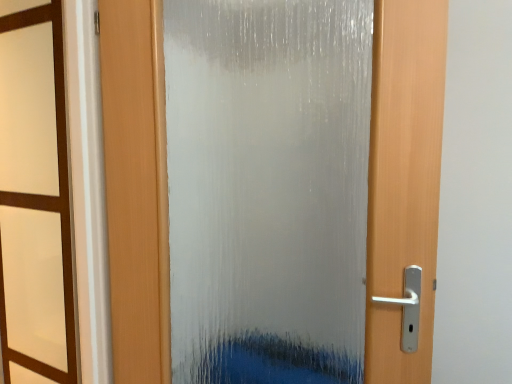
Question: Considering the positions of brown wood window frame at left and frosted glass door at center in the image, is brown wood window frame at left taller or shorter than frosted glass door at center?

Choices:
 (A) tall
 (B) short

Answer: (B)

Question: Visually, is brown wood window frame at left positioned to the left or to the right of frosted glass door at center?

Choices:
 (A) left
 (B) right

Answer: (A)

Question: Would you say brown wood window frame at left is inside or outside frosted glass door at center?

Choices:
 (A) outside
 (B) inside

Answer: (A)

Question: In the image, is frosted glass door at center positioned in front of or behind brown wood window frame at left?

Choices:
 (A) behind
 (B) front

Answer: (A)

Question: Does point (379, 23) appear closer or farther from the camera than point (48, 344)?

Choices:
 (A) closer
 (B) farther

Answer: (A)

Question: In terms of width, does frosted glass door at center look wider or thinner when compared to brown wood window frame at left?

Choices:
 (A) thin
 (B) wide

Answer: (B)

Question: In the image, is frosted glass door at center on the left side or the right side of brown wood window frame at left?

Choices:
 (A) right
 (B) left

Answer: (A)